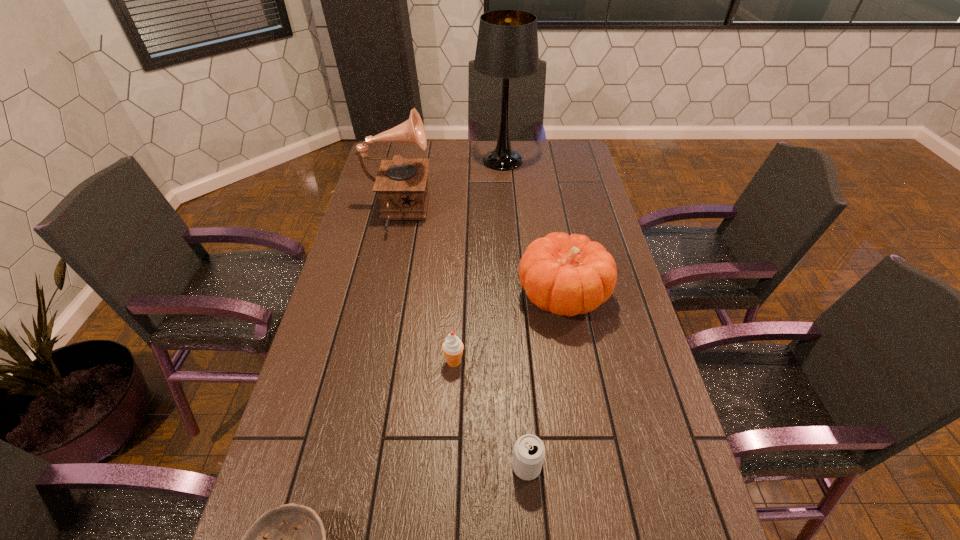
At what (x,y) coordinates should I click in order to perform the action: click on vacant position in the image that satisfies the following two spatial constraints: 1. on the horn of the fifth nearest object; 2. on the left side of the fourth tallest object. Please return your answer as a coordinate pair (x, y). The image size is (960, 540). Looking at the image, I should click on 364,362.

The image size is (960, 540). I want to click on vacant region that satisfies the following two spatial constraints: 1. on the horn of the second tallest object; 2. on the back side of the third shortest object, so click(x=364, y=362).